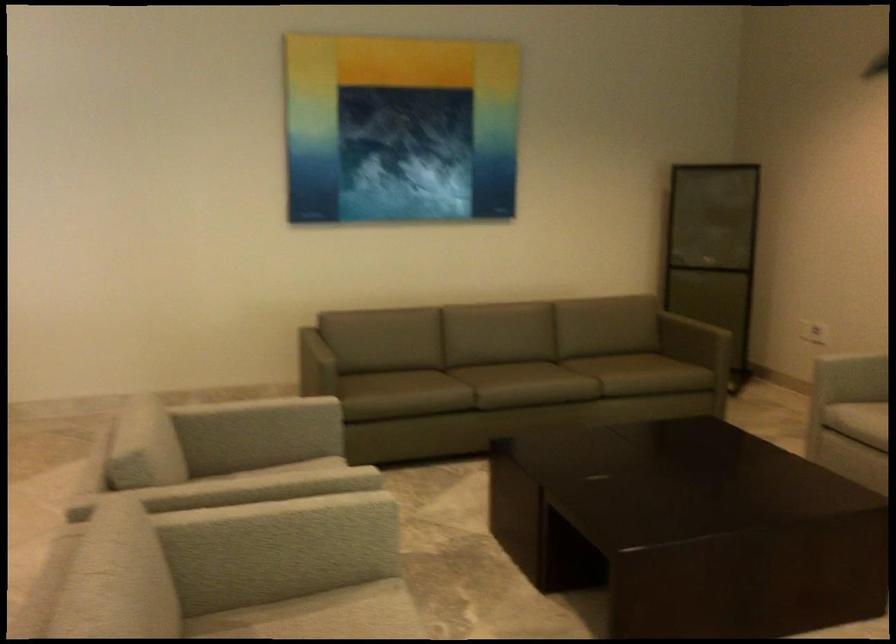
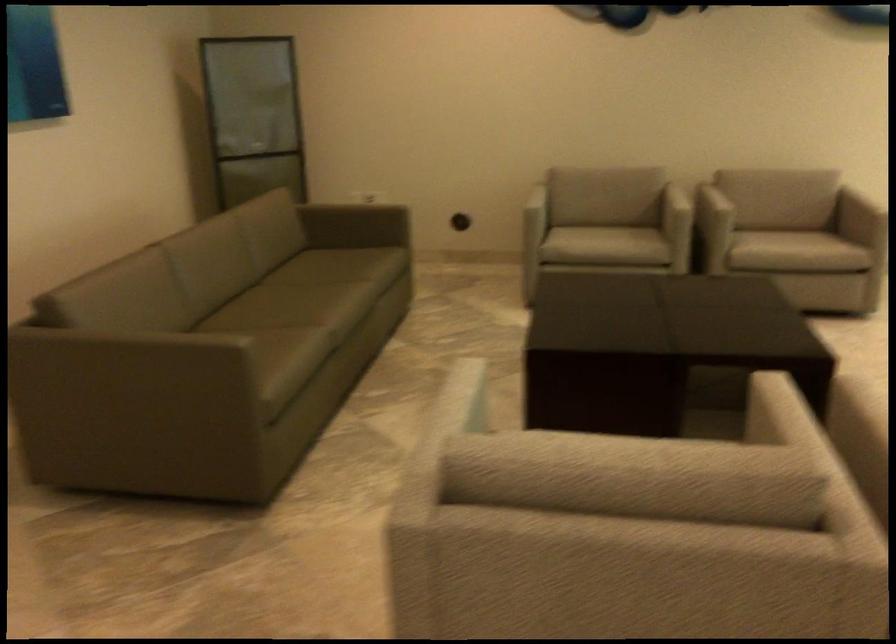
In the second image, find the point that corresponds to the point at 524,384 in the first image.

(363, 297)